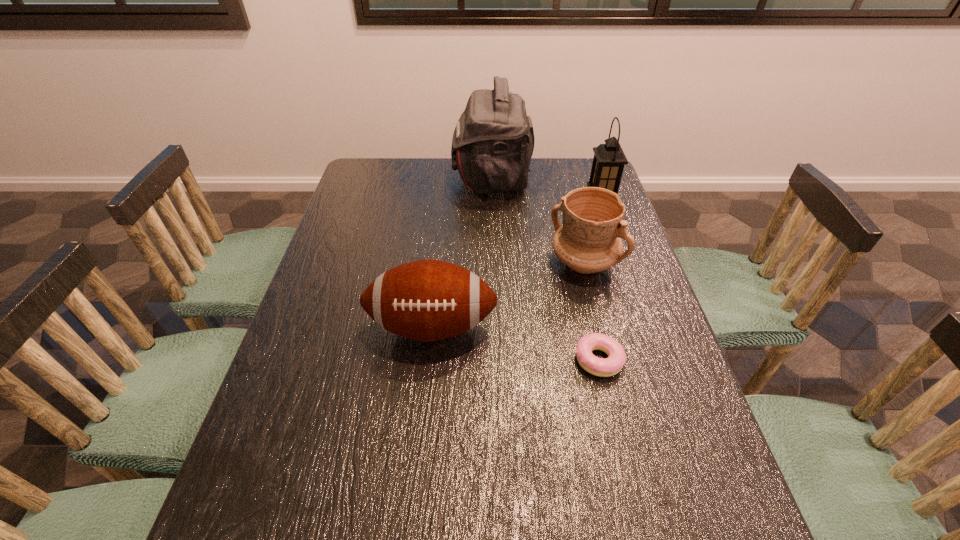
What are the coordinates of `vacant region located on the laces of the football` in the screenshot? It's located at (425, 394).

Locate an element on the screen. blank area located on the back of the doughnut is located at coordinates pos(585,301).

I want to click on shoulder bag that is at the far edge, so click(x=493, y=142).

I want to click on lantern at the far edge, so click(609, 160).

The image size is (960, 540). In order to click on lantern at the right edge in this screenshot , I will do `click(609, 160)`.

The width and height of the screenshot is (960, 540). I want to click on pottery situated at the right edge, so click(x=589, y=240).

I want to click on doughnut situated at the right edge, so click(603, 367).

Find the location of a particular element. The width and height of the screenshot is (960, 540). object that is positioned at the far right corner is located at coordinates (609, 160).

This screenshot has height=540, width=960. Identify the location of free location at the far edge. (455, 179).

Locate an element on the screen. The width and height of the screenshot is (960, 540). free region at the left edge of the desktop is located at coordinates (302, 333).